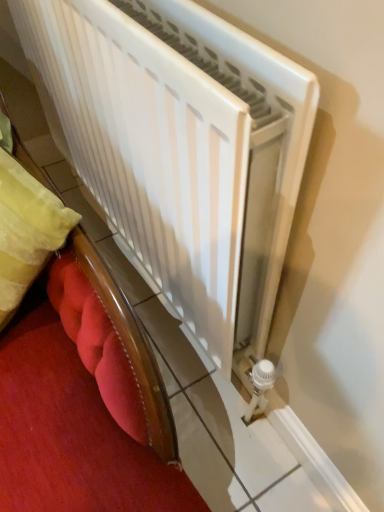
The image size is (384, 512). What do you see at coordinates (180, 148) in the screenshot?
I see `white matte radiator at center` at bounding box center [180, 148].

You are a GUI agent. You are given a task and a screenshot of the screen. Output one action in this format:
    pyautogui.click(x=<x>, y=<y>)
    Task: Click on the white matte radiator at center
    The image size is (384, 512).
    Given the screenshot: What is the action you would take?
    pyautogui.click(x=180, y=148)

Where is `white matte radiator at center`? Image resolution: width=384 pixels, height=512 pixels. white matte radiator at center is located at coordinates (180, 148).